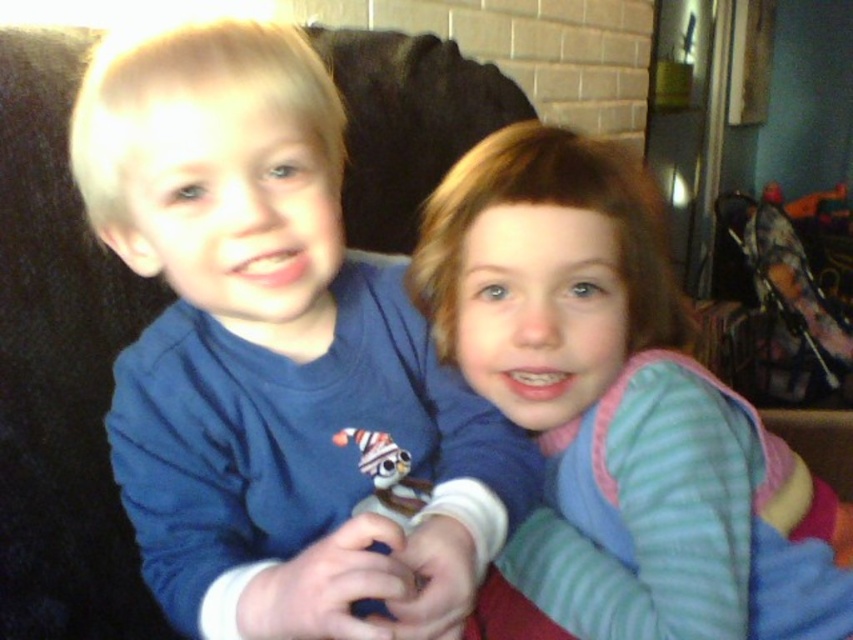
Does blue cotton shirt at left appear under striped fleece sweater at center?

Actually, blue cotton shirt at left is above striped fleece sweater at center.

Does blue cotton shirt at left appear on the left side of striped fleece sweater at center?

Yes, blue cotton shirt at left is to the left of striped fleece sweater at center.

Does point (131, 52) come closer to viewer compared to point (647, 609)?

Yes, point (131, 52) is closer to viewer.

The image size is (853, 640). What are the coordinates of `blue cotton shirt at left` in the screenshot? It's located at (276, 356).